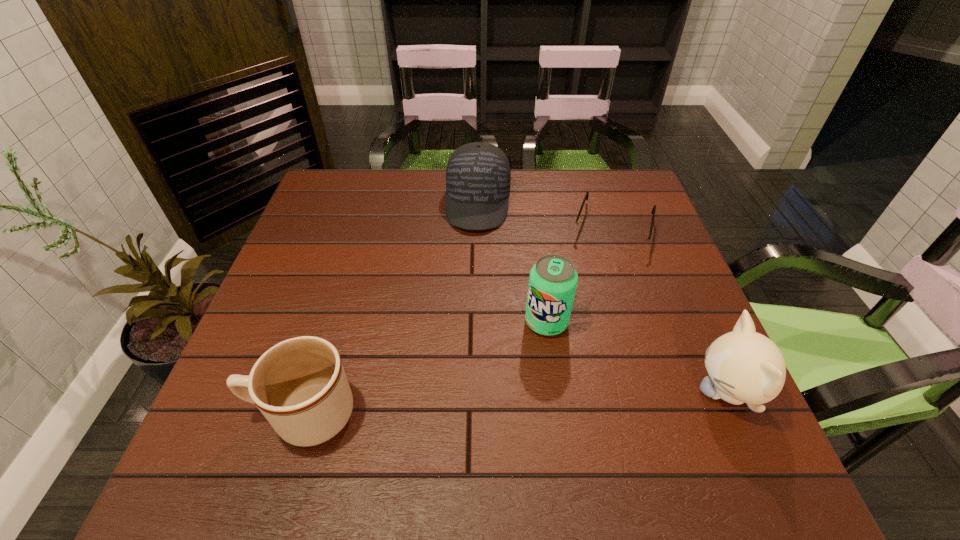
This screenshot has height=540, width=960. In the image, there is a desktop. Identify the location of free space at the left edge. (321, 240).

Image resolution: width=960 pixels, height=540 pixels. In the image, there is a desktop. Find the location of `free space at the right edge`. free space at the right edge is located at coordinates (683, 299).

Image resolution: width=960 pixels, height=540 pixels. I want to click on free region at the far left corner of the desktop, so click(x=313, y=194).

Where is `free space at the far right corner`? The height and width of the screenshot is (540, 960). free space at the far right corner is located at coordinates (619, 194).

At what (x,y) coordinates should I click in order to perform the action: click on free space between the third object from right to left and the kitten. Please return your answer as a coordinate pair (x, y). The image size is (960, 540). Looking at the image, I should click on (636, 357).

Identify the location of free space that is in between the pop soda and the second object from left to right. [x=513, y=262].

Find the location of `vacant area that lies between the kitten and the spectacles`. vacant area that lies between the kitten and the spectacles is located at coordinates (669, 310).

Find the location of a particular element. vacant space that is in between the fourth object from right to left and the shortest object is located at coordinates (545, 215).

You are a GUI agent. You are given a task and a screenshot of the screen. Output one action in this format:
    pyautogui.click(x=<x>, y=<y>)
    Task: Click on the free space between the third object from left to right and the spectacles
    
    Given the screenshot: What is the action you would take?
    pyautogui.click(x=580, y=275)

What are the coordinates of `vacant area between the shortest object and the third nearest object` in the screenshot? It's located at (580, 275).